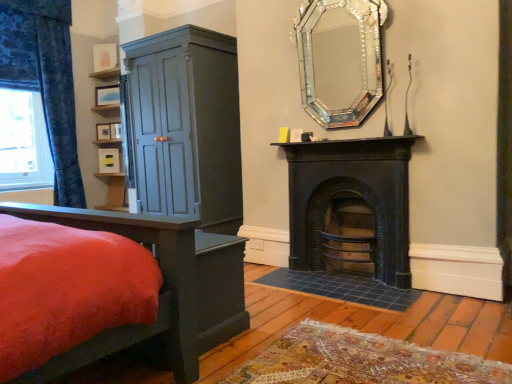
Locate an element on the screen. Image resolution: width=512 pixels, height=384 pixels. matte wooden picture frame at upper left, the fifth picture frame when ordered from bottom to top is located at coordinates (104, 57).

How much space does matte black picture frame at center, the third picture frame when ordered from top to bottom, occupy vertically?

matte black picture frame at center, the third picture frame when ordered from top to bottom, is 20.73 centimeters tall.

In order to face white plastic power outlet at lower center, should I rotate leftwards or rightwards?

A 0.011 degree turn to the right will do.

What do you see at coordinates (106, 96) in the screenshot? I see `matte wooden picture frame at upper left, marked as the 2th picture frame in a top-to-bottom arrangement` at bounding box center [106, 96].

Identify the location of matte white picture frame at upper left, arranged as the 2th picture frame when ordered from the bottom. The image size is (512, 384). (103, 131).

In the scene shown: Measure the distance between black cast iron fireplace at center, which appears as the 1th fireplace when ordered from the bottom, and camera.

black cast iron fireplace at center, which appears as the 1th fireplace when ordered from the bottom, and camera are 2.69 meters apart from each other.

Where is `matte wooden picture frame at upper left, the fifth picture frame when ordered from bottom to top`? Image resolution: width=512 pixels, height=384 pixels. matte wooden picture frame at upper left, the fifth picture frame when ordered from bottom to top is located at coordinates (104, 57).

How much distance is there between matte blue cabinet at left and blue floral fabric curtain at left?

matte blue cabinet at left and blue floral fabric curtain at left are 1.46 meters apart from each other.

Is matte blue cabinet at left aimed at blue floral fabric curtain at left?

No.

From a real-world perspective, is matte blue cabinet at left under blue floral fabric curtain at left?

Indeed, from a real-world perspective, matte blue cabinet at left is positioned beneath blue floral fabric curtain at left.

Is matte blue cabinet at left taller or shorter than blue floral fabric curtain at left?

In the image, matte blue cabinet at left appears to be shorter than blue floral fabric curtain at left.

Can you confirm if matte wooden picture frame at upper left, the fifth picture frame when ordered from bottom to top, is bigger than matte black picture frame at center, which is counted as the third picture frame, starting from the bottom?

Yes, matte wooden picture frame at upper left, the fifth picture frame when ordered from bottom to top, is bigger than matte black picture frame at center, which is counted as the third picture frame, starting from the bottom.

Is matte wooden picture frame at upper left, the fifth picture frame when ordered from bottom to top, positioned with its back to matte black picture frame at center, which is counted as the third picture frame, starting from the bottom?

matte wooden picture frame at upper left, the fifth picture frame when ordered from bottom to top, is not turned away from matte black picture frame at center, which is counted as the third picture frame, starting from the bottom.

Which object is closer to the camera, matte wooden picture frame at upper left, acting as the first picture frame starting from the top, or matte black picture frame at center, the third picture frame when ordered from top to bottom?

matte wooden picture frame at upper left, acting as the first picture frame starting from the top, is more forward.

Choose the correct answer: Is matte wooden picture frame at upper left, the fifth picture frame when ordered from bottom to top, inside matte black picture frame at center, which is counted as the third picture frame, starting from the bottom, or outside it?

matte wooden picture frame at upper left, the fifth picture frame when ordered from bottom to top, exists outside the volume of matte black picture frame at center, which is counted as the third picture frame, starting from the bottom.

Is matte white picture frame at upper left, arranged as the 4th picture frame when viewed from the top, shorter than matte wooden picture frame at upper left, marked as the 2th picture frame in a top-to-bottom arrangement?

Yes, matte white picture frame at upper left, arranged as the 4th picture frame when viewed from the top, is shorter than matte wooden picture frame at upper left, marked as the 2th picture frame in a top-to-bottom arrangement.

From the image's perspective, would you say matte white picture frame at upper left, arranged as the 2th picture frame when ordered from the bottom, is positioned over matte wooden picture frame at upper left, positioned as the 4th picture frame in bottom-to-top order?

No, from the image's perspective, matte white picture frame at upper left, arranged as the 2th picture frame when ordered from the bottom, is not above matte wooden picture frame at upper left, positioned as the 4th picture frame in bottom-to-top order.

Can you confirm if matte white picture frame at upper left, arranged as the 2th picture frame when ordered from the bottom, is thinner than matte wooden picture frame at upper left, positioned as the 4th picture frame in bottom-to-top order?

Yes.

Measure the distance between matte wood shelf at upper left and matte wooden picture frame at upper left, the fifth picture frame when ordered from bottom to top.

matte wood shelf at upper left and matte wooden picture frame at upper left, the fifth picture frame when ordered from bottom to top, are 5.51 inches apart.

In the scene shown: From a real-world perspective, which object stands above the other?

matte wooden picture frame at upper left, acting as the first picture frame starting from the top.

Which of these two, matte wood shelf at upper left or matte wooden picture frame at upper left, acting as the first picture frame starting from the top, stands shorter?

matte wood shelf at upper left.

Is matte wood shelf at upper left bigger than matte wooden picture frame at upper left, the fifth picture frame when ordered from bottom to top?

Yes.

Does velvet red bed at lower left have a lesser width compared to matte white picture frame at upper left, arranged as the 2th picture frame when ordered from the bottom?

No, velvet red bed at lower left is not thinner than matte white picture frame at upper left, arranged as the 2th picture frame when ordered from the bottom.

From the picture: Can you confirm if velvet red bed at lower left is smaller than matte white picture frame at upper left, arranged as the 2th picture frame when ordered from the bottom?

No, velvet red bed at lower left is not smaller than matte white picture frame at upper left, arranged as the 2th picture frame when ordered from the bottom.

Does velvet red bed at lower left turn towards matte white picture frame at upper left, arranged as the 4th picture frame when viewed from the top?

No, velvet red bed at lower left is not oriented towards matte white picture frame at upper left, arranged as the 4th picture frame when viewed from the top.

Based on the photo, can you tell me how much white plastic power outlet at lower center and black cast iron fireplace at center, which appears as the 1th fireplace when ordered from the bottom, differ in facing direction?

The facing directions of white plastic power outlet at lower center and black cast iron fireplace at center, which appears as the 1th fireplace when ordered from the bottom, are 2.31 degrees apart.

Which is less distant, (257, 246) or (380, 227)?

Point (257, 246).

From a real-world perspective, is white plastic power outlet at lower center on top of black cast iron fireplace at center, which appears as the 1th fireplace when ordered from the bottom?

Actually, white plastic power outlet at lower center is physically below black cast iron fireplace at center, which appears as the 1th fireplace when ordered from the bottom, in the real world.

Can you confirm if white plastic power outlet at lower center is positioned to the left of black cast iron fireplace at center, which appears as the 1th fireplace when ordered from the bottom?

Yes.

Does matte yellow picture frame at center, positioned as the first picture frame in bottom-to-top order, turn towards blue floral fabric curtain at left?

No, matte yellow picture frame at center, positioned as the first picture frame in bottom-to-top order, is not turned towards blue floral fabric curtain at left.

From a real-world perspective, is matte yellow picture frame at center, which is counted as the 5th picture frame, starting from the top, physically located above or below blue floral fabric curtain at left?

matte yellow picture frame at center, which is counted as the 5th picture frame, starting from the top, is below blue floral fabric curtain at left.

Is point (109, 151) behind point (60, 32)?

Yes.

Where is `curtain on the left of matte blue cabinet at left`? Image resolution: width=512 pixels, height=384 pixels. curtain on the left of matte blue cabinet at left is located at coordinates (45, 81).

Which picture frame is the 3rd one when counting from the right side of the matte wooden picture frame at upper left, acting as the first picture frame starting from the top? Please provide its 2D coordinates.

[(115, 131)]

Based on their spatial positions, is blue floral fabric curtain at left or matte white picture frame at upper left, arranged as the 2th picture frame when ordered from the bottom, closer to matte wood shelf at upper left?

The object closer to matte wood shelf at upper left is matte white picture frame at upper left, arranged as the 2th picture frame when ordered from the bottom.

Looking at the image, which one is located closer to white plastic power outlet at lower center, matte white picture frame at upper left, arranged as the 2th picture frame when ordered from the bottom, or matte wood shelf at upper left?

matte white picture frame at upper left, arranged as the 2th picture frame when ordered from the bottom, lies closer to white plastic power outlet at lower center than the other object.

Based on the photo, looking at the image, which one is located closer to matte wood shelf at upper left, matte black picture frame at center, which is counted as the third picture frame, starting from the bottom, or velvet red bed at lower left?

Among the two, matte black picture frame at center, which is counted as the third picture frame, starting from the bottom, is located nearer to matte wood shelf at upper left.

From the image, which object appears to be farther from matte white picture frame at upper left, arranged as the 2th picture frame when ordered from the bottom, velvet red bed at lower left or matte black picture frame at center, the third picture frame when ordered from top to bottom?

velvet red bed at lower left lies further to matte white picture frame at upper left, arranged as the 2th picture frame when ordered from the bottom, than the other object.

Which object lies further to the anchor point matte wooden picture frame at upper left, marked as the 2th picture frame in a top-to-bottom arrangement, blue floral fabric at left or matte yellow picture frame at center, positioned as the first picture frame in bottom-to-top order?

blue floral fabric at left.

Estimate the real-world distances between objects in this image. Which object is further from matte wooden picture frame at upper left, marked as the 2th picture frame in a top-to-bottom arrangement, black cast iron fireplace at center, which appears as the 1th fireplace when ordered from the bottom, or matte blue cabinet at left?

black cast iron fireplace at center, which appears as the 1th fireplace when ordered from the bottom, is positioned further to the anchor matte wooden picture frame at upper left, marked as the 2th picture frame in a top-to-bottom arrangement.

Considering their positions, is matte wooden picture frame at upper left, the fifth picture frame when ordered from bottom to top, positioned further to matte wood shelf at upper left than matte black picture frame at center, the third picture frame when ordered from top to bottom?

matte black picture frame at center, the third picture frame when ordered from top to bottom, is further to matte wood shelf at upper left.

Looking at the image, which one is located closer to matte wood shelf at upper left, matte wooden picture frame at upper left, the fifth picture frame when ordered from bottom to top, or black cast iron fireplace at center, which appears as the 1th fireplace when ordered from the bottom?

matte wooden picture frame at upper left, the fifth picture frame when ordered from bottom to top, lies closer to matte wood shelf at upper left than the other object.

Identify the location of power outlet situated between matte wood shelf at upper left and black cast iron fireplace at center, the 2th fireplace viewed from the top, from left to right. click(255, 244).

Identify the location of shelf between blue floral fabric curtain at left and matte wooden picture frame at upper left, marked as the 2th picture frame in a top-to-bottom arrangement, in the front-back direction. The width and height of the screenshot is (512, 384). (106, 74).

Locate an element on the screen. Image resolution: width=512 pixels, height=384 pixels. shelf located between matte blue cabinet at left and matte wooden picture frame at upper left, marked as the 2th picture frame in a top-to-bottom arrangement, in the depth direction is located at coordinates (106, 74).

This screenshot has height=384, width=512. What are the coordinates of `fireplace between matte blue cabinet at left and black cast iron fireplace at center, the 2th fireplace viewed from the top, from left to right` in the screenshot? It's located at (341, 58).